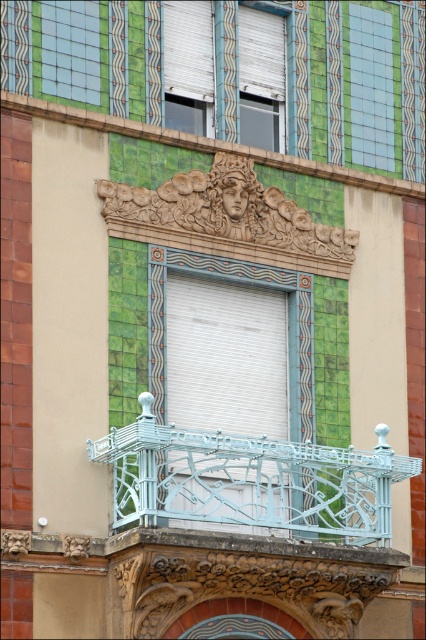
Question: Which of the following is the closest to the observer?

Choices:
 (A) (293, 248)
 (B) (241, 118)
 (C) (360, 35)

Answer: (A)

Question: Which point is farther to the camera?

Choices:
 (A) (149, 349)
 (B) (183, 186)

Answer: (B)

Question: Which of the following is the closest to the observer?

Choices:
 (A) white matte window at center
 (B) white matte window at upper center

Answer: (A)

Question: Can you confirm if light blue wrought iron at center is bigger than golden textured sculpture at upper center?

Choices:
 (A) yes
 (B) no

Answer: (A)

Question: Is white matte window at upper center to the right of green glass window at upper left from the viewer's perspective?

Choices:
 (A) no
 (B) yes

Answer: (B)

Question: Considering the relative positions of light blue wrought iron at center and green tile at upper right in the image provided, where is light blue wrought iron at center located with respect to green tile at upper right?

Choices:
 (A) left
 (B) right

Answer: (A)